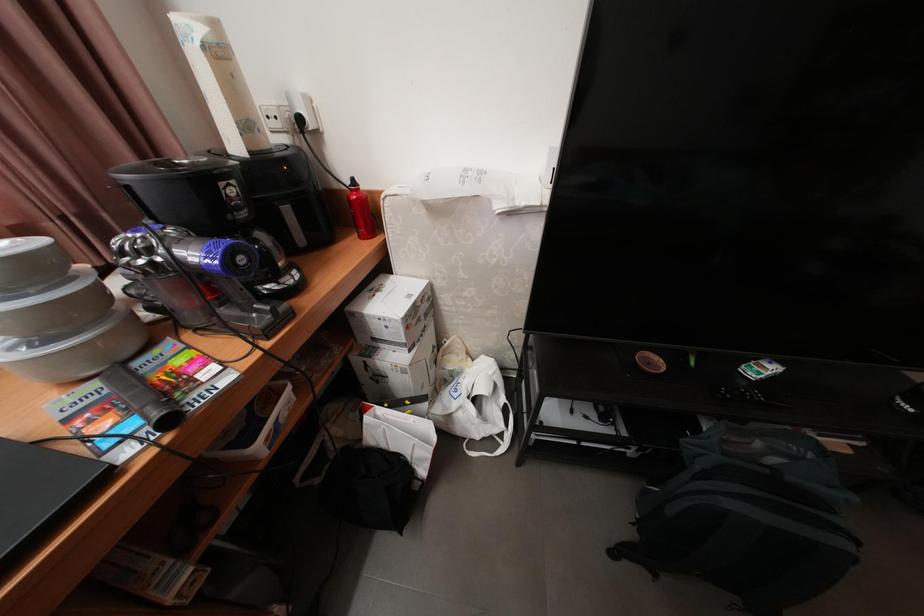
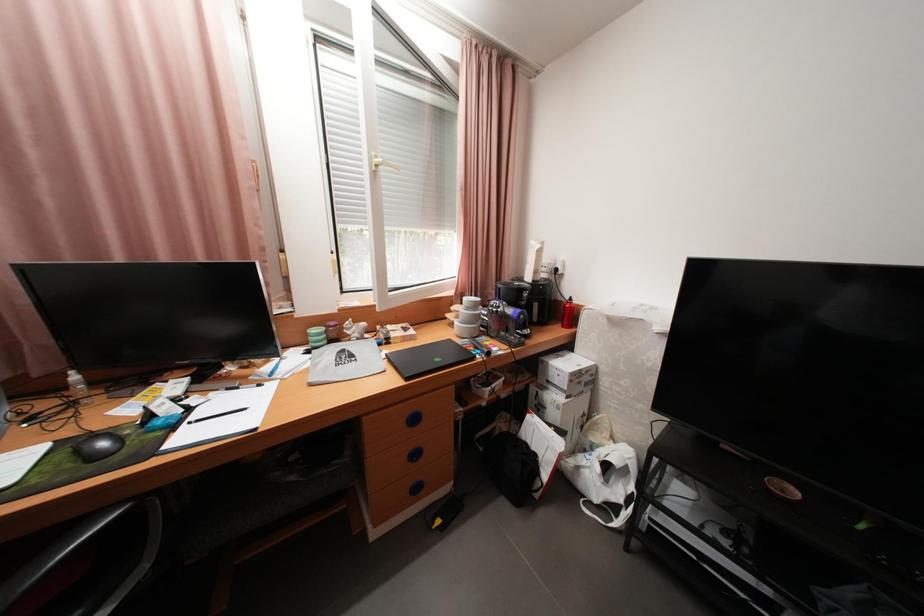
Question: The first image is from the beginning of the video and the second image is from the end. How did the camera likely rotate when shooting the video?

Choices:
 (A) Left
 (B) Right
 (C) Up
 (D) Down

Answer: (A)